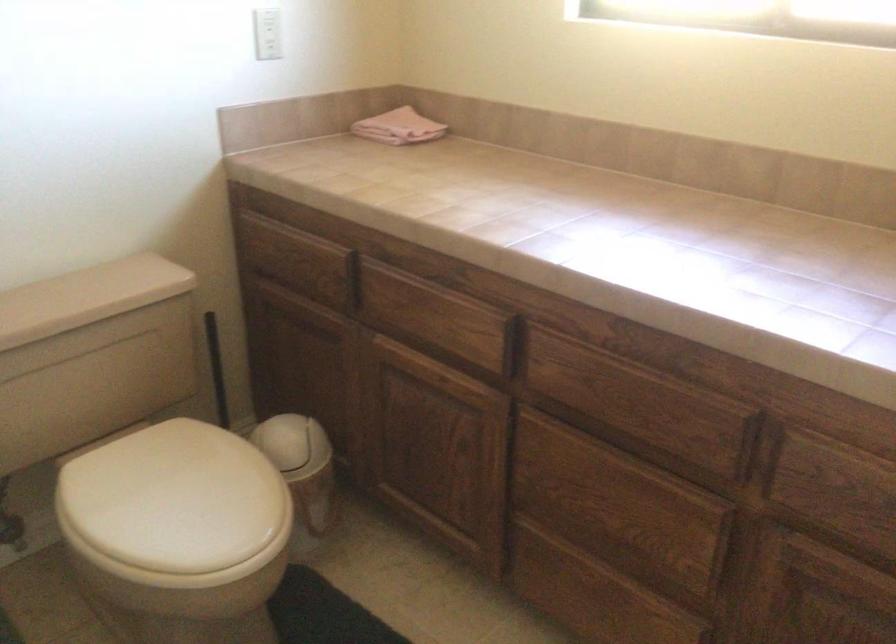
What do you see at coordinates (268, 33) in the screenshot?
I see `the white light switch` at bounding box center [268, 33].